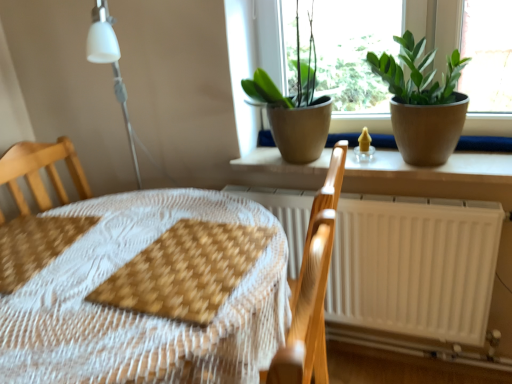
Where is `blank space situated above brown woven placemat at center, arranged as the 2th sheet when viewed from the left (from a real-world perspective)`? The width and height of the screenshot is (512, 384). blank space situated above brown woven placemat at center, arranged as the 2th sheet when viewed from the left (from a real-world perspective) is located at coordinates (173, 275).